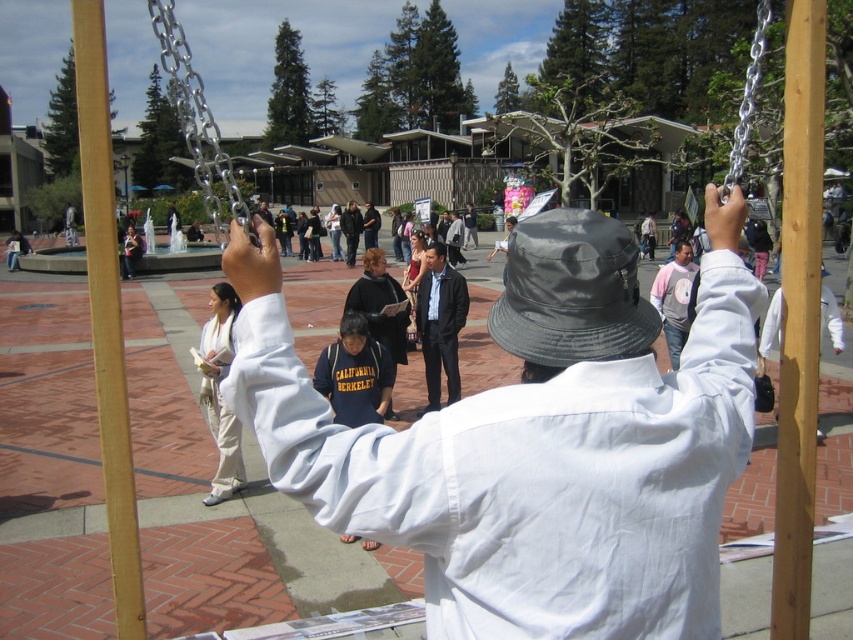
Question: Which is farther from the dark gray leather jacket at center?

Choices:
 (A) light brown wooden pole at right
 (B) dark blue suit at center
 (C) dark blue fleece jacket at center
 (D) white matte shirt at center

Answer: (D)

Question: Does white matte shirt at center appear on the right side of dark blue suit at center?

Choices:
 (A) yes
 (B) no

Answer: (A)

Question: In this image, where is light brown wooden pole at right located relative to dark gray leather jacket at center?

Choices:
 (A) left
 (B) right

Answer: (B)

Question: Which point is closer to the camera?

Choices:
 (A) (424, 289)
 (B) (115, 433)
 (C) (450, 244)

Answer: (B)

Question: Which object is closer to the camera taking this photo?

Choices:
 (A) dark gray jacket at center
 (B) black leather hat at center
 (C) dark gray fabric jacket at center
 (D) wooden pole at left

Answer: (B)

Question: Is wooden pole at left to the left of dark gray leather jacket at center from the viewer's perspective?

Choices:
 (A) no
 (B) yes

Answer: (B)